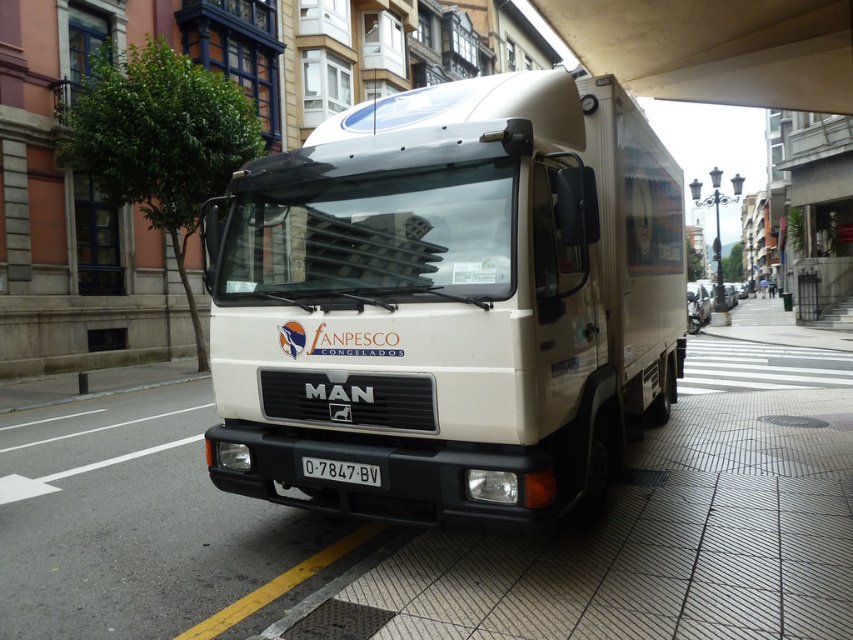
You are standing at point 0.0, 0.0 in the city street scene. Where is the white matte truck at center located?

The white matte truck at center is located at point (451,301).

You are a delivery driver who needs to check the license plate of the white matte truck at center. Can you reach the white plastic license plate at center from your current position inside the truck without getting out?

The white matte truck at center is 4.22 feet away from the white plastic license plate at center. Since the distance is relatively short, it might be possible to reach the license plate from inside the truck, but this depends on the driver seat position and arm length. However, typically, the license plate is mounted at the rear of the vehicle, which would require exiting the vehicle to access it.

You are standing on the street in front of the beige MAN delivery truck. There is a point marked at coordinates [448,532] which corresponds to a location on the white tile pavement at center. If you walk straight towards the truck, will you reach the truck before reaching the white tile pavement at center?

The point at [448,532] indicates the white tile pavement at center, which is between you and the truck. Therefore, you will reach the white tile pavement at center before reaching the truck.